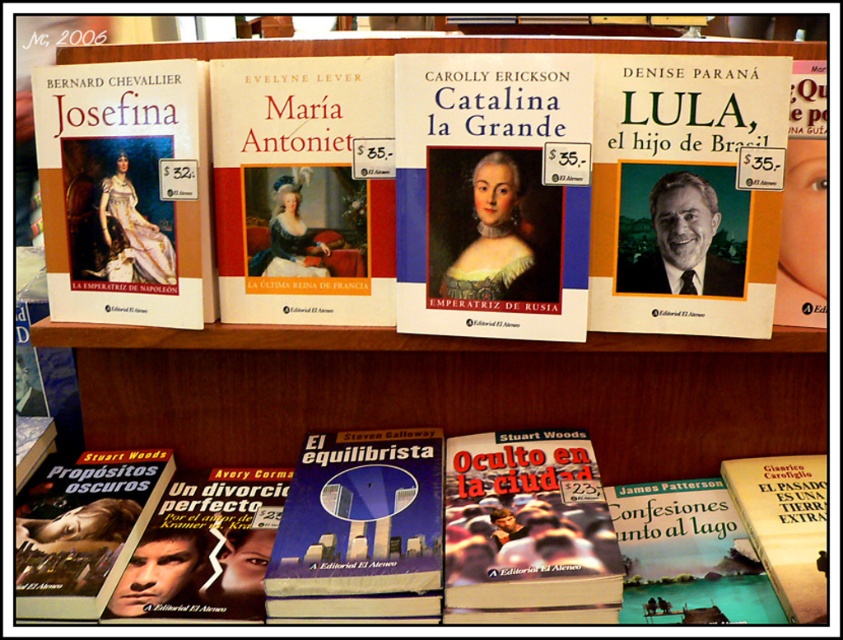
From the picture: Who is lower down, matte black book at upper right or blue hardcover book at center?

Positioned lower is blue hardcover book at center.

How distant is matte black book at upper right from blue hardcover book at center?

A distance of 16.26 inches exists between matte black book at upper right and blue hardcover book at center.

Describe the element at coordinates (686, 193) in the screenshot. I see `matte black book at upper right` at that location.

Identify the location of matte black book at upper right. (686, 193).

Is point (476, 116) behind point (189, 269)?

No, (476, 116) is closer to viewer.

Can you confirm if matte white book at center is positioned above matte gold book at upper left?

No, matte white book at center is not above matte gold book at upper left.

Is point (417, 246) less distant than point (186, 198)?

No, it is not.

The height and width of the screenshot is (640, 843). Find the location of `matte white book at center`. matte white book at center is located at coordinates (492, 195).

Can you confirm if hardcover book at lower center is smaller than hardcover book at lower right?

No, hardcover book at lower center is not smaller than hardcover book at lower right.

Is point (533, 596) positioned before point (686, 566)?

Yes, it is.

Is point (215, 561) positioned after point (629, 612)?

Yes, point (215, 561) is farther from viewer.

You are a GUI agent. You are given a task and a screenshot of the screen. Output one action in this format:
    pyautogui.click(x=<x>, y=<y>)
    Task: Click on the hardcover book at lower center
    
    Given the screenshot: What is the action you would take?
    pyautogui.click(x=609, y=541)